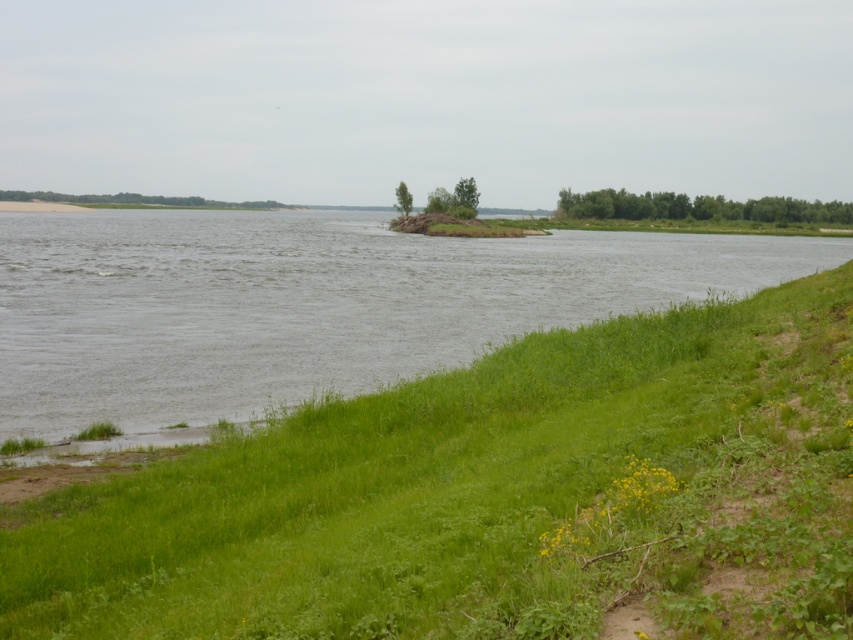
Who is more distant from viewer, [51,573] or [453,337]?

The point [453,337] is more distant.

Does point (810, 406) come closer to viewer compared to point (231, 269)?

Yes.

Which is in front, point (798, 456) or point (50, 442)?

Point (798, 456)

Find the location of a particular element. Image resolution: width=853 pixels, height=640 pixels. green grassy at lower left is located at coordinates (491, 497).